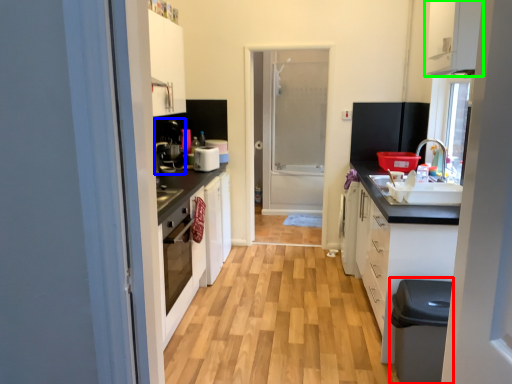
Question: Based on their relative distances, which object is nearer to dish washer (highlighted by a red box)? Choose from coffee machine (highlighted by a blue box) and cabinetry (highlighted by a green box).

Choices:
 (A) coffee machine
 (B) cabinetry

Answer: (B)